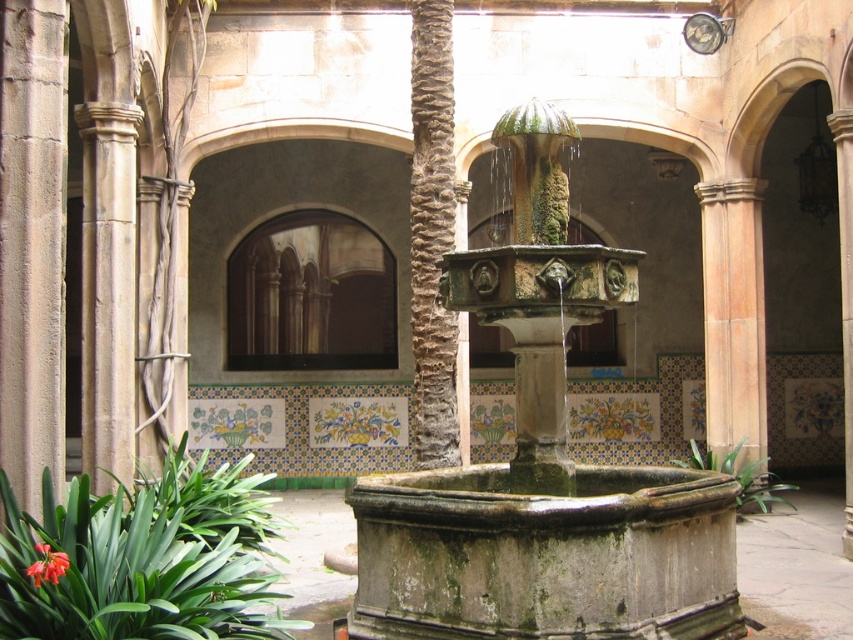
Question: Which point is closer to the camera?

Choices:
 (A) (357, 520)
 (B) (28, 572)
 (C) (59, 588)
 (D) (418, 141)

Answer: (B)

Question: Does green mossy stone fountain at center come behind rough textured stone pillar at center?

Choices:
 (A) yes
 (B) no

Answer: (B)

Question: Can you confirm if rough textured stone pillar at center is positioned above bright red petal at lower left?

Choices:
 (A) no
 (B) yes

Answer: (B)

Question: Is rough textured stone pillar at center positioned behind bright red petal at lower left?

Choices:
 (A) no
 (B) yes

Answer: (B)

Question: Considering the real-world distances, which object is farthest from the green leafy plant at center?

Choices:
 (A) rough textured stone pillar at center
 (B) green mossy stone fountain at center
 (C) green leafy plant at lower left
 (D) bright red petal at lower left

Answer: (D)

Question: Which object is positioned farthest from the green leafy plant at center?

Choices:
 (A) bright red petal at lower left
 (B) rough textured stone pillar at center
 (C) green leafy plant at lower left

Answer: (A)